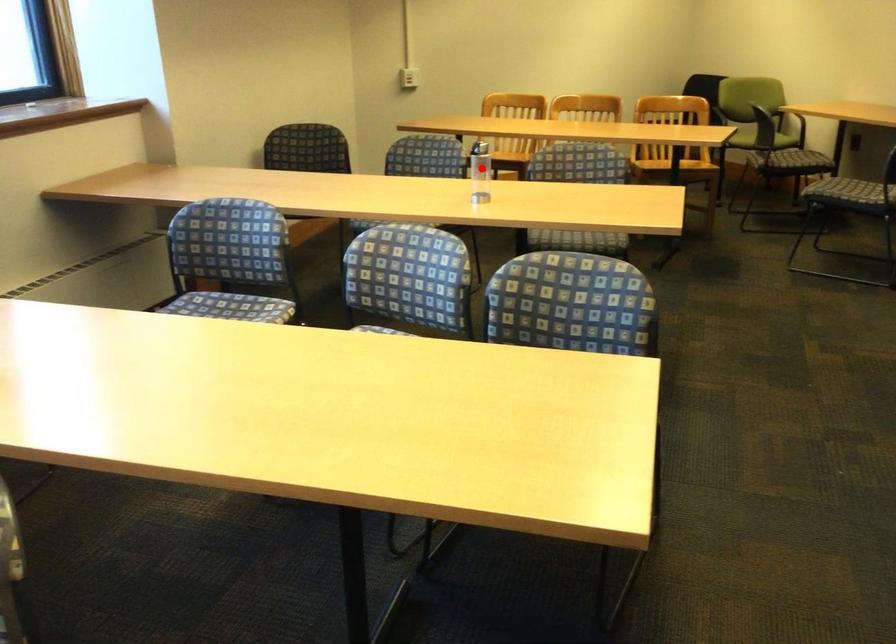
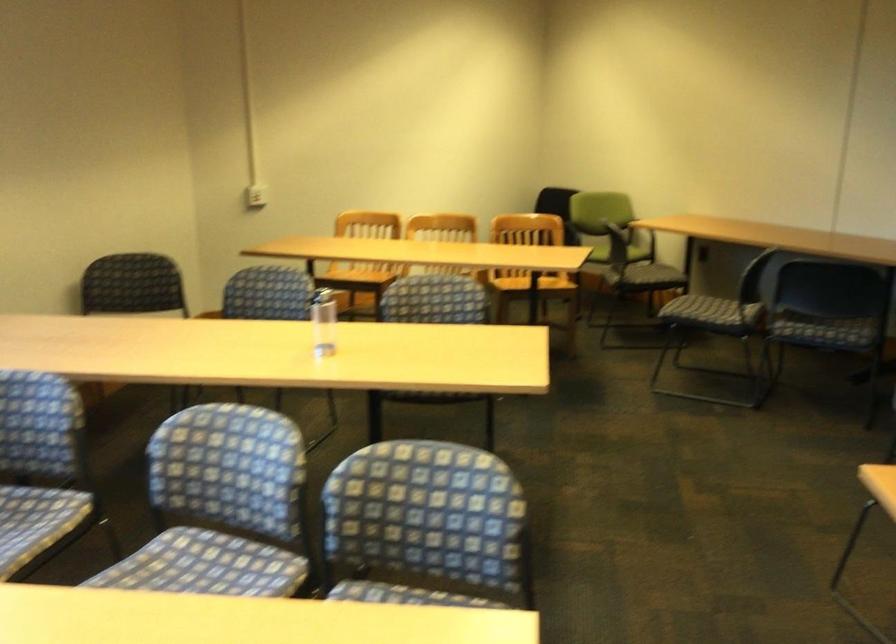
Find the pixel in the second image that matches the highlighted location in the first image.

(323, 322)